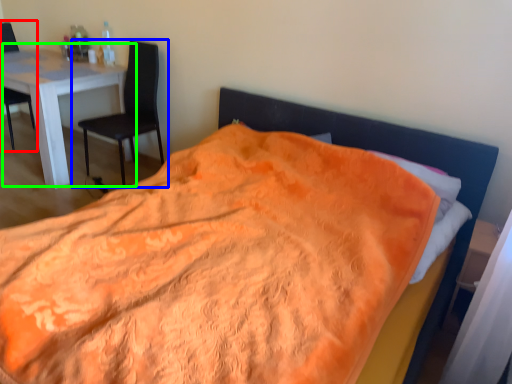
Question: Which object is the farthest from chair (highlighted by a red box)? Choose among these: chair (highlighted by a blue box) or table (highlighted by a green box).

Choices:
 (A) chair
 (B) table

Answer: (A)